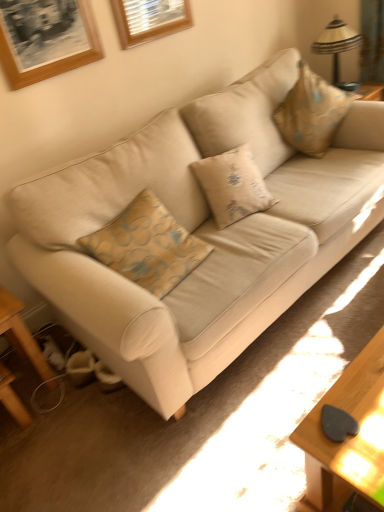
Question: Is wooden table at lower left situated inside beige fabric couch at center or outside?

Choices:
 (A) inside
 (B) outside

Answer: (B)

Question: Looking at their shapes, would you say wooden table at lower left is wider or thinner than beige fabric couch at center?

Choices:
 (A) wide
 (B) thin

Answer: (B)

Question: Which is nearer to the wooden picture frame at upper left, which ranks as the second picture frame in back-to-front order?

Choices:
 (A) beige fabric pillow at upper right
 (B) wooden picture frame at upper center, which appears as the second picture frame when viewed from the left
 (C) beige fabric couch at center
 (D) wooden table at lower left
 (E) metallic silver table lamp at upper right

Answer: (B)

Question: Which object is positioned farthest from the wooden picture frame at upper center, which is counted as the 1th picture frame, starting from the right?

Choices:
 (A) beige fabric couch at center
 (B) wooden table at lower left
 (C) beige fabric pillow at upper right
 (D) metallic silver table lamp at upper right
 (E) wooden picture frame at upper left, which ranks as the first picture frame in front-to-back order

Answer: (B)